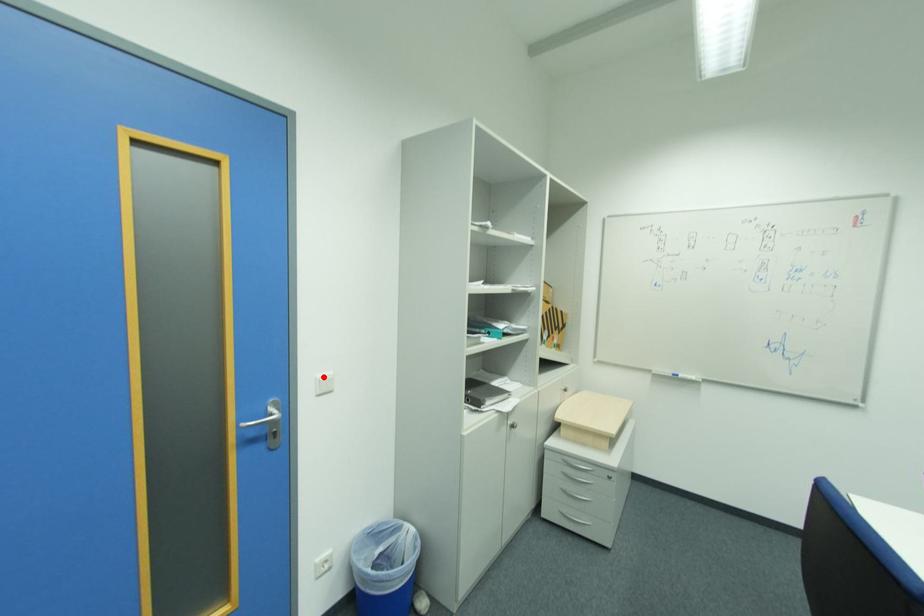
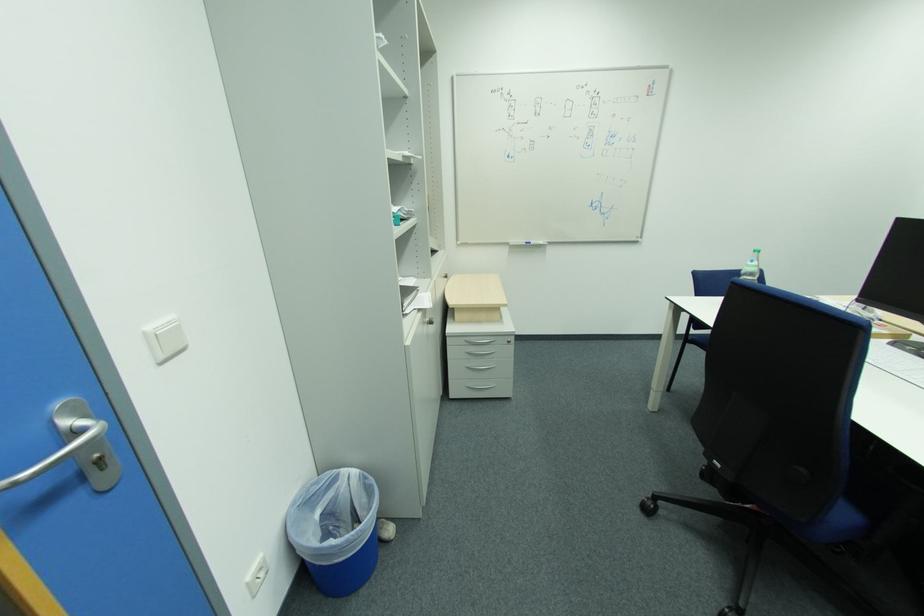
Where in the second image is the point corresponding to the highlighted location from the first image?

(154, 329)